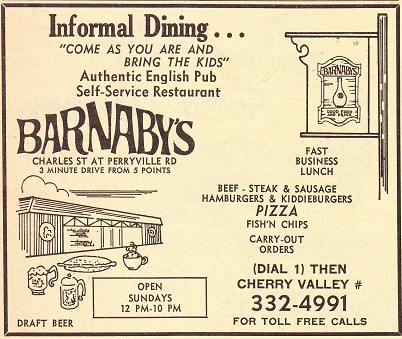
You are a GUI agent. You are given a task and a screenshot of the screen. Output one action in this format:
    pyautogui.click(x=<x>, y=<y>)
    Task: Click on the informal dining
    The height and width of the screenshot is (339, 402).
    Given the screenshot: What is the action you would take?
    (x=122, y=19), (x=192, y=20)